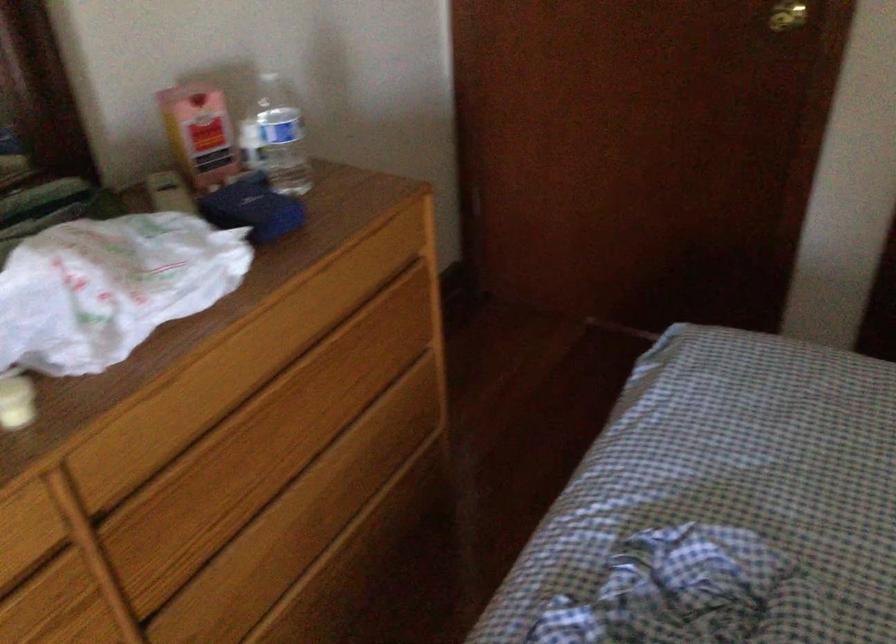
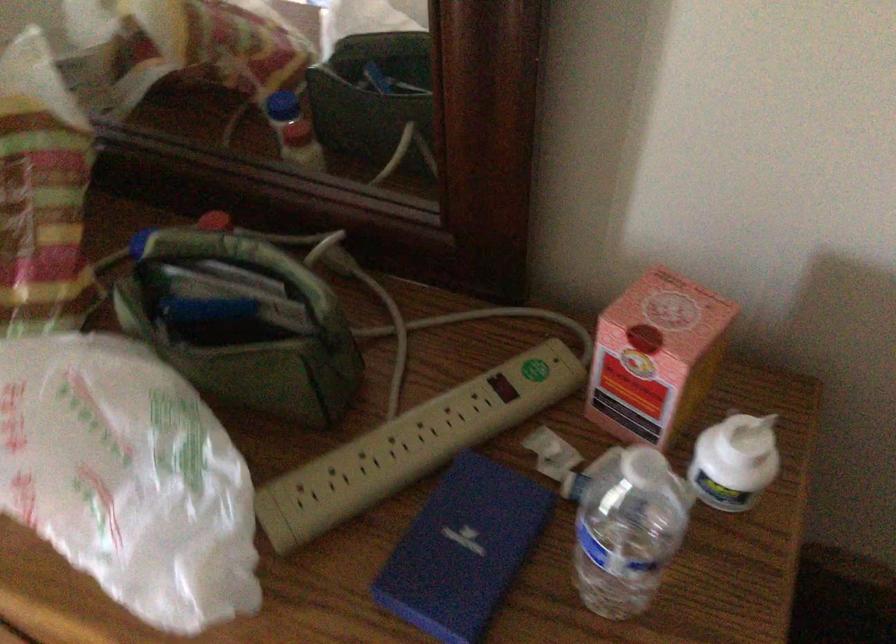
In the second image, find the point that corresponds to the point at 254,124 in the first image.

(754, 435)